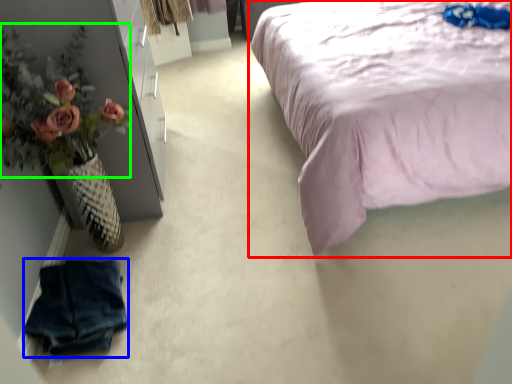
Question: Based on their relative distances, which object is farther from bed (highlighted by a red box)? Choose from clothing (highlighted by a blue box) and floral arrangement (highlighted by a green box).

Choices:
 (A) clothing
 (B) floral arrangement

Answer: (A)